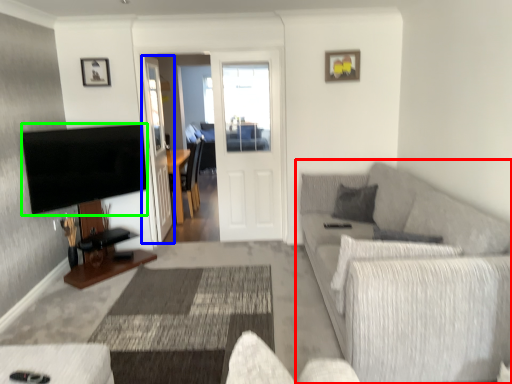
Question: Considering the real-world distances, which object is closest to studio couch (highlighted by a red box)? glass door (highlighted by a blue box) or television (highlighted by a green box).

Choices:
 (A) glass door
 (B) television

Answer: (B)